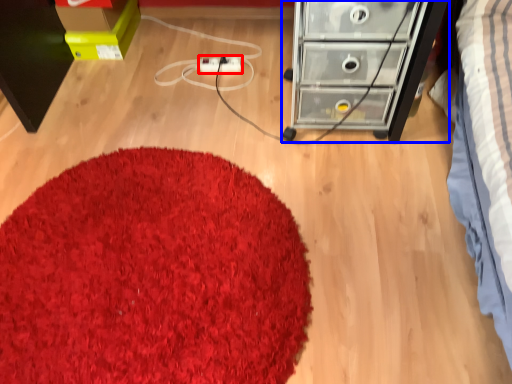
Question: Which object appears farthest to the camera in this image, extension cord (highlighted by a red box) or chest of drawers (highlighted by a blue box)?

Choices:
 (A) extension cord
 (B) chest of drawers

Answer: (A)